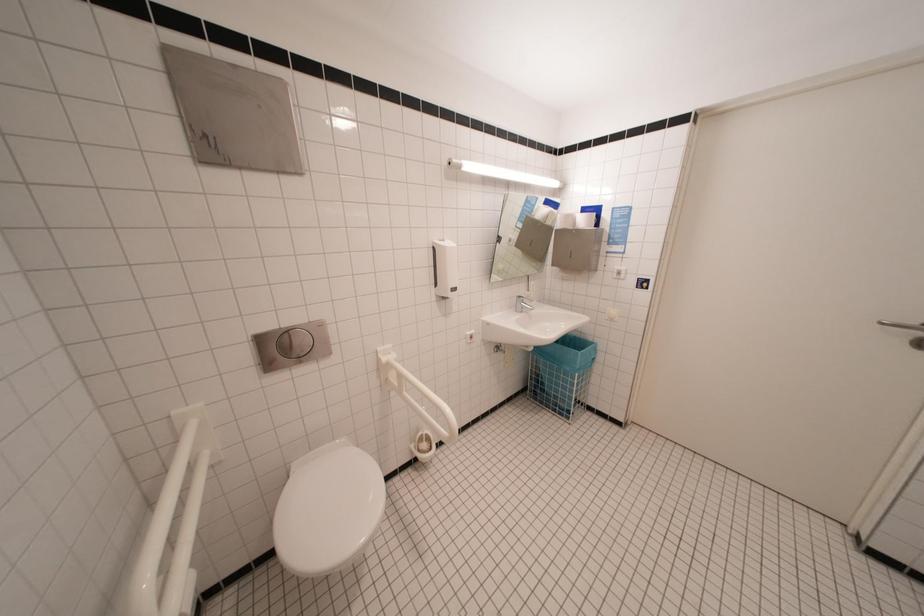
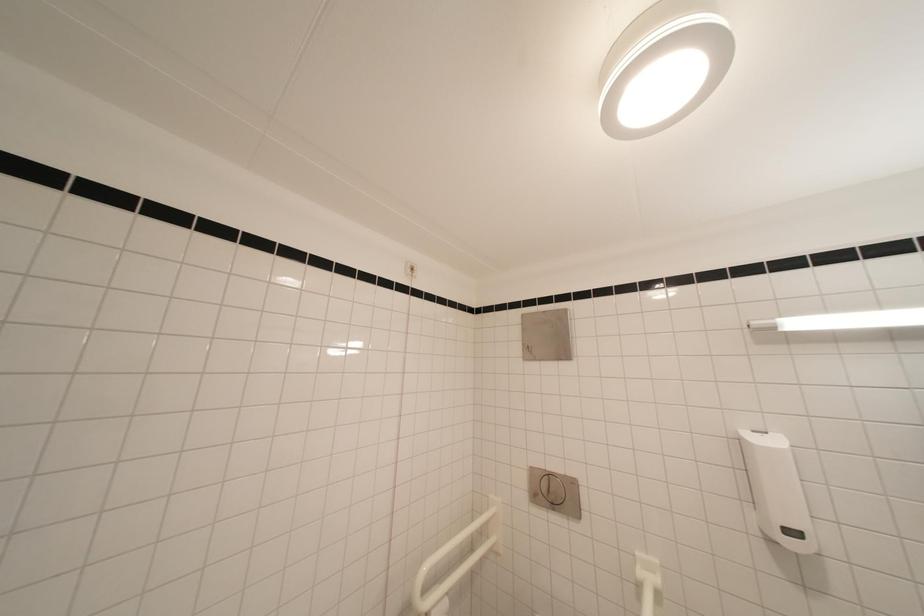
The images are taken continuously from a first-person perspective. In which direction is your viewpoint rotating?

The rotation direction of the camera is left-up.